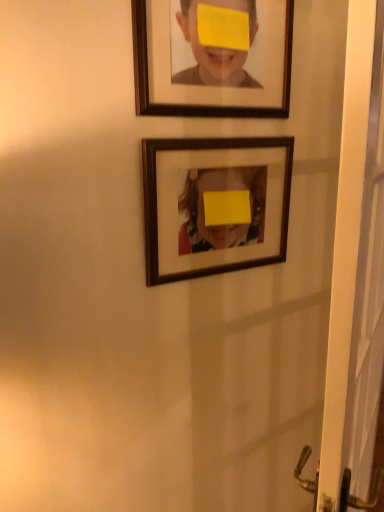
Question: Is white plastic screen door at right at the left side of wooden frame at upper center, the 2th picture frame in the bottom-to-top sequence?

Choices:
 (A) yes
 (B) no

Answer: (B)

Question: Is white plastic screen door at right taller than wooden frame at upper center, positioned as the first picture frame in top-to-bottom order?

Choices:
 (A) yes
 (B) no

Answer: (A)

Question: From a real-world perspective, is white plastic screen door at right on top of wooden frame at upper center, the 2th picture frame in the bottom-to-top sequence?

Choices:
 (A) yes
 (B) no

Answer: (B)

Question: Considering the relative positions of white plastic screen door at right and wooden frame at upper center, the 2th picture frame in the bottom-to-top sequence, in the image provided, is white plastic screen door at right to the right of wooden frame at upper center, the 2th picture frame in the bottom-to-top sequence, from the viewer's perspective?

Choices:
 (A) yes
 (B) no

Answer: (A)

Question: Can you confirm if white plastic screen door at right is wider than wooden frame at upper center, positioned as the first picture frame in top-to-bottom order?

Choices:
 (A) no
 (B) yes

Answer: (B)

Question: In terms of height, does wooden frame at center, which is counted as the 1th picture frame, starting from the bottom, look taller or shorter compared to wooden frame at upper center, positioned as the first picture frame in top-to-bottom order?

Choices:
 (A) tall
 (B) short

Answer: (A)

Question: From the image's perspective, relative to wooden frame at upper center, positioned as the first picture frame in top-to-bottom order, is wooden frame at center, the second picture frame from the top, above or below?

Choices:
 (A) below
 (B) above

Answer: (A)

Question: Considering their positions, is wooden frame at center, which is counted as the 1th picture frame, starting from the bottom, located in front of or behind wooden frame at upper center, the 2th picture frame in the bottom-to-top sequence?

Choices:
 (A) front
 (B) behind

Answer: (B)

Question: From a real-world perspective, is wooden frame at center, which is counted as the 1th picture frame, starting from the bottom, physically located above or below wooden frame at upper center, the 2th picture frame in the bottom-to-top sequence?

Choices:
 (A) above
 (B) below

Answer: (B)

Question: Considering the positions of wooden frame at center, which is counted as the 1th picture frame, starting from the bottom, and white plastic screen door at right in the image, is wooden frame at center, which is counted as the 1th picture frame, starting from the bottom, wider or thinner than white plastic screen door at right?

Choices:
 (A) thin
 (B) wide

Answer: (A)

Question: From their relative heights in the image, would you say wooden frame at center, which is counted as the 1th picture frame, starting from the bottom, is taller or shorter than white plastic screen door at right?

Choices:
 (A) tall
 (B) short

Answer: (B)

Question: Looking at the image, does wooden frame at center, the second picture frame from the top, seem bigger or smaller compared to white plastic screen door at right?

Choices:
 (A) big
 (B) small

Answer: (B)

Question: From a real-world perspective, is wooden frame at center, which is counted as the 1th picture frame, starting from the bottom, physically located above or below white plastic screen door at right?

Choices:
 (A) below
 (B) above

Answer: (B)

Question: Considering their positions, is white plastic screen door at right located in front of or behind wooden frame at center, the second picture frame from the top?

Choices:
 (A) front
 (B) behind

Answer: (A)

Question: From their relative heights in the image, would you say white plastic screen door at right is taller or shorter than wooden frame at center, the second picture frame from the top?

Choices:
 (A) tall
 (B) short

Answer: (A)